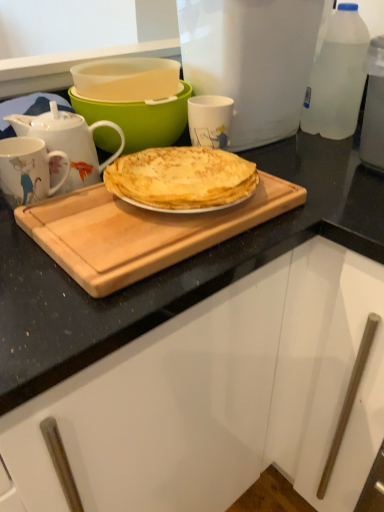
Question: Looking at the image, does white plastic container at upper center seem bigger or smaller compared to white glossy mug at upper center, which appears as the second coffee cup when viewed from the left?

Choices:
 (A) small
 (B) big

Answer: (B)

Question: From the image's perspective, is white plastic container at upper center above or below white glossy mug at upper center, which is counted as the 1th coffee cup, starting from the right?

Choices:
 (A) below
 (B) above

Answer: (B)

Question: Estimate the real-world distances between objects in this image. Which object is closer to the clear plastic bottle at upper right?

Choices:
 (A) matte green bowl at upper center
 (B) white plastic container at upper center
 (C) wooden cutting board at center
 (D) porcelain floral mug at left, the second coffee cup when ordered from back to front
 (E) white glossy mug at upper center, which appears as the second coffee cup when viewed from the left

Answer: (B)

Question: Which is nearer to the white glossy mug at upper center, which is counted as the 1th coffee cup, starting from the right?

Choices:
 (A) wooden cutting board at center
 (B) white glossy teapot at upper left
 (C) porcelain floral mug at left, the second coffee cup from the right
 (D) clear plastic bottle at upper right
 (E) matte green bowl at upper center

Answer: (E)